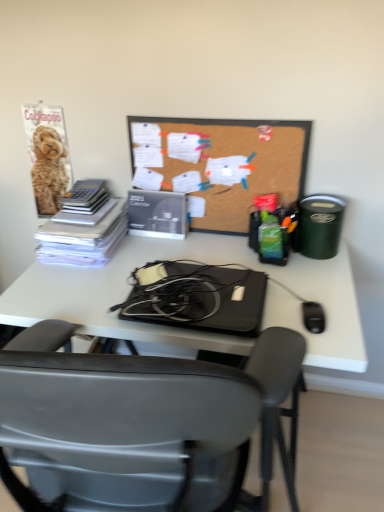
Find the location of a particular element. The width and height of the screenshot is (384, 512). vacant space positioned to the left of black plastic mouse at lower right is located at coordinates tap(276, 320).